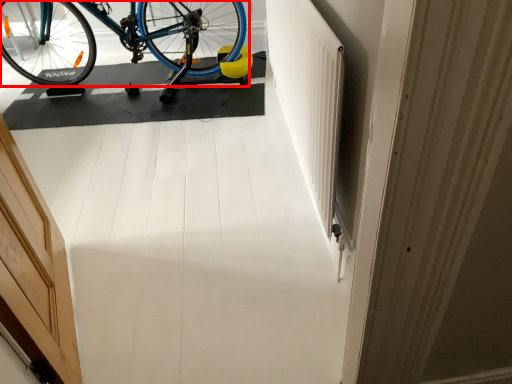
Question: From the image's perspective, where is bicycle (annotated by the red box) located relative to door?

Choices:
 (A) below
 (B) above

Answer: (B)